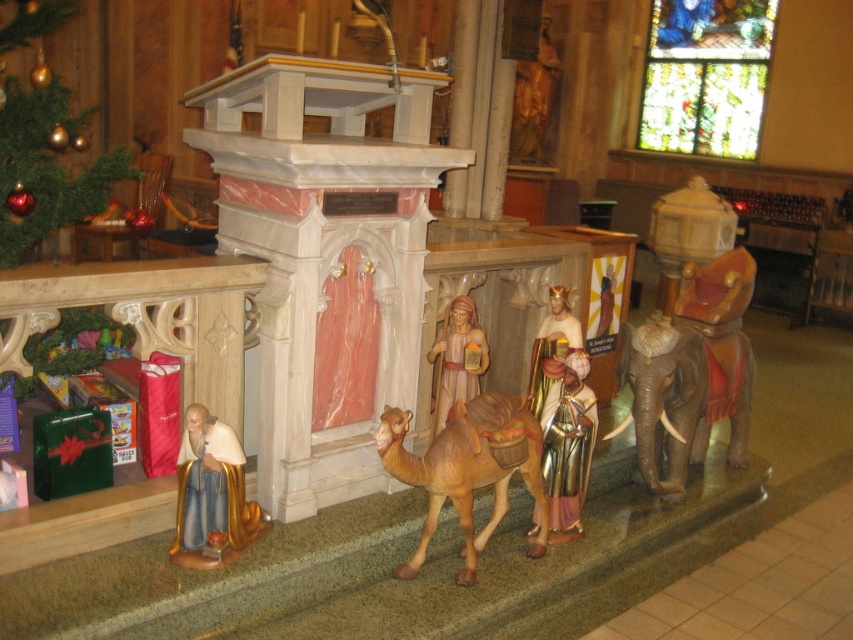
Question: Does brown matte camel at center appear under gold glossy statue at lower left?

Choices:
 (A) no
 (B) yes

Answer: (B)

Question: Which object appears closest to the camera in this image?

Choices:
 (A) gold glossy statue at lower left
 (B) gold metallic figure at center

Answer: (A)

Question: Which point appears farthest from the camera in this image?

Choices:
 (A) (521, 448)
 (B) (233, 461)
 (C) (463, 308)

Answer: (C)

Question: Can you confirm if gold metallic figure at center is positioned to the left of wooden figure at center?

Choices:
 (A) no
 (B) yes

Answer: (A)

Question: Can you confirm if gold glossy statue at lower left is positioned below gold metallic figure at center?

Choices:
 (A) yes
 (B) no

Answer: (A)

Question: Among these points, which one is farthest from the camera?

Choices:
 (A) (467, 296)
 (B) (434, 464)
 (C) (209, 436)

Answer: (A)